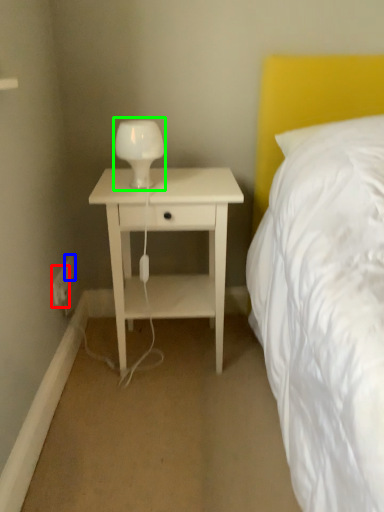
Question: Based on their relative distances, which object is farther from electric outlet (highlighted by a red box)? Choose from electric outlet (highlighted by a blue box) and bedside lamp (highlighted by a green box).

Choices:
 (A) electric outlet
 (B) bedside lamp

Answer: (B)